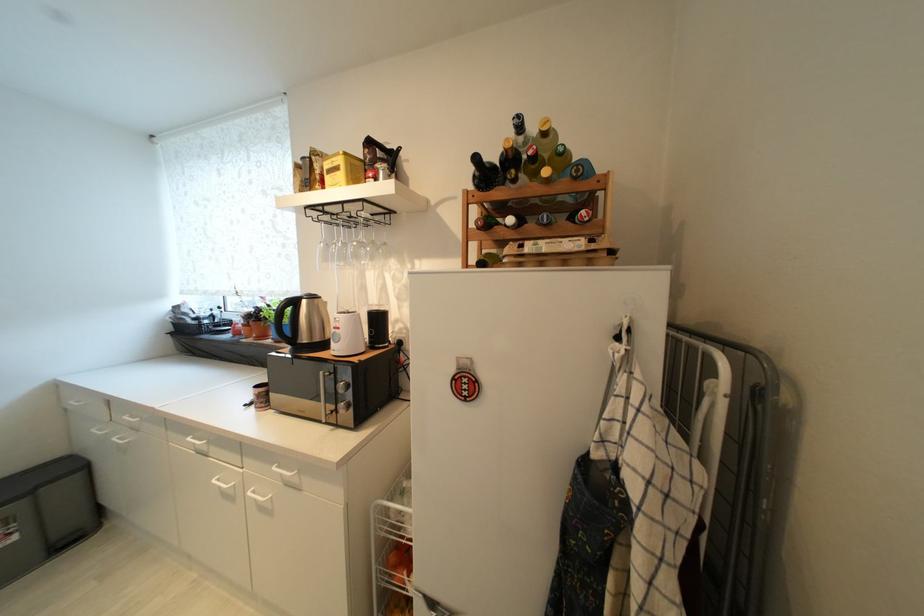
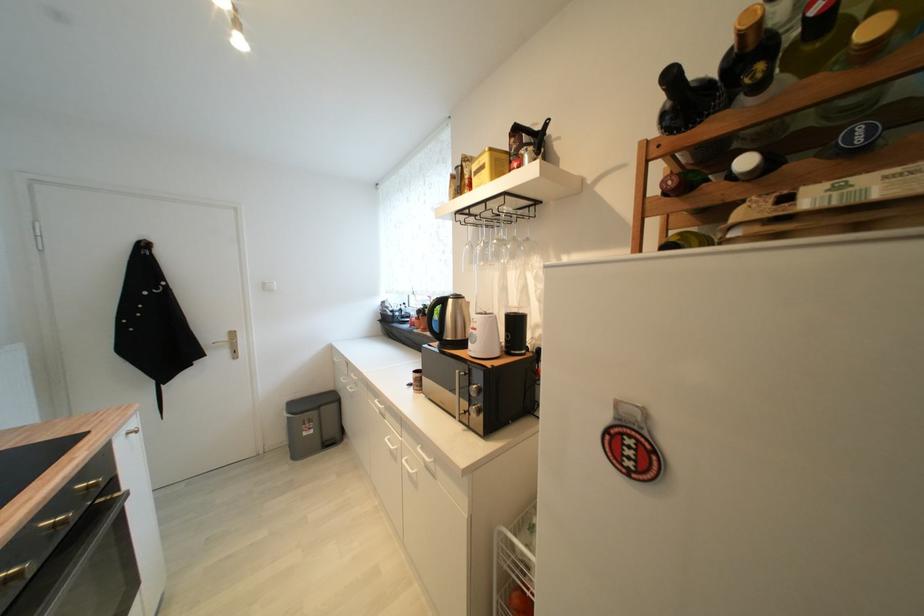
Where in the second image is the point corresponding to (492,256) from the first image?

(687, 236)